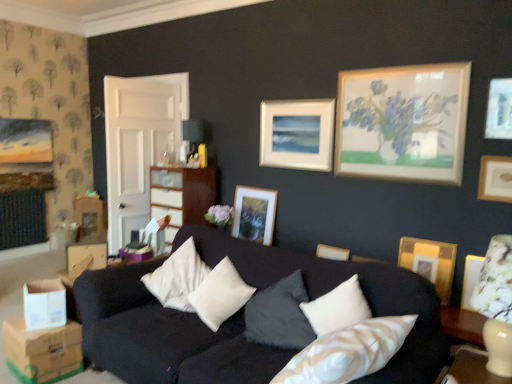
Describe the element at coordinates (181, 196) in the screenshot. The height and width of the screenshot is (384, 512). I see `matte cream dresser at center` at that location.

From the picture: How much space does white cardboard box at lower left, positioned as the first cardboard box in top-to-bottom order, occupy horizontally?

white cardboard box at lower left, positioned as the first cardboard box in top-to-bottom order, is 26.90 centimeters in width.

Image resolution: width=512 pixels, height=384 pixels. What do you see at coordinates (42, 351) in the screenshot?
I see `brown cardboard box at lower left, placed as the 2th cardboard box when sorted from top to bottom` at bounding box center [42, 351].

What is the approximate width of matte gold picture frame at center, marked as the 4th picture frame in a front-to-back arrangement?

matte gold picture frame at center, marked as the 4th picture frame in a front-to-back arrangement, is 2.54 inches wide.

Where is `white soft cushion at center`? The image size is (512, 384). white soft cushion at center is located at coordinates (220, 295).

Locate an element on the screen. The height and width of the screenshot is (384, 512). wooden picture frame at upper right, marked as the first picture frame in a front-to-back arrangement is located at coordinates (495, 179).

Measure the distance between point [415,257] and camera.

Point [415,257] is 3.48 meters away from camera.

How much space does gold textured picture frame at right, the third picture frame positioned from the left, occupy horizontally?

gold textured picture frame at right, the third picture frame positioned from the left, is 3.68 inches wide.

I want to click on matte cream dresser at center, so click(181, 196).

Between white cardboard box at lower left, positioned as the first cardboard box in top-to-bottom order, and wooden picture frame at upper right, the fourth picture frame positioned from the left, which one has more height?

wooden picture frame at upper right, the fourth picture frame positioned from the left, is taller.

Can you tell me how much white cardboard box at lower left, positioned as the first cardboard box in top-to-bottom order, and wooden picture frame at upper right, the fourth picture frame positioned from the left, differ in facing direction?

white cardboard box at lower left, positioned as the first cardboard box in top-to-bottom order, and wooden picture frame at upper right, the fourth picture frame positioned from the left, are facing 25 degrees away from each other.

Considering the sizes of objects white cardboard box at lower left, the second cardboard box ordered from the bottom, and wooden picture frame at upper right, marked as the first picture frame in a front-to-back arrangement, in the image provided, who is wider, white cardboard box at lower left, the second cardboard box ordered from the bottom, or wooden picture frame at upper right, marked as the first picture frame in a front-to-back arrangement,?

Wider between the two is white cardboard box at lower left, the second cardboard box ordered from the bottom.

In the image, is white cardboard box at lower left, the second cardboard box ordered from the bottom, positioned in front of or behind wooden picture frame at upper right, the fourth picture frame positioned from the left?

white cardboard box at lower left, the second cardboard box ordered from the bottom, is positioned closer to the viewer than wooden picture frame at upper right, the fourth picture frame positioned from the left.

Is point (153, 203) positioned behind point (72, 373)?

Yes, it is behind point (72, 373).

Can you confirm if matte cream dresser at center is taller than brown cardboard box at lower left, placed as the 2th cardboard box when sorted from top to bottom?

Correct, matte cream dresser at center is much taller as brown cardboard box at lower left, placed as the 2th cardboard box when sorted from top to bottom.

Is matte cream dresser at center positioned in front of brown cardboard box at lower left, the 1th cardboard box ordered from the bottom?

No, it is not.

Are matte cream dresser at center and wooden picture frame at upper right, acting as the 4th picture frame starting from the back, making contact?

No, matte cream dresser at center is not next to wooden picture frame at upper right, acting as the 4th picture frame starting from the back.

From the image's perspective, who appears lower, matte cream dresser at center or wooden picture frame at upper right, the fourth picture frame positioned from the left?

matte cream dresser at center appears lower in the image.

Considering the sizes of objects matte cream dresser at center and wooden picture frame at upper right, acting as the 4th picture frame starting from the back, in the image provided, who is wider, matte cream dresser at center or wooden picture frame at upper right, acting as the 4th picture frame starting from the back,?

matte cream dresser at center.

Considering the relative sizes of matte cream dresser at center and wooden picture frame at upper right, marked as the first picture frame in a front-to-back arrangement, in the image provided, is matte cream dresser at center shorter than wooden picture frame at upper right, marked as the first picture frame in a front-to-back arrangement,?

No, matte cream dresser at center is not shorter than wooden picture frame at upper right, marked as the first picture frame in a front-to-back arrangement.

Is white cardboard box at lower left, the second cardboard box ordered from the bottom, positioned in front of matte cream dresser at center?

That is True.

What are the coordinates of `dresser lying above the white cardboard box at lower left, the second cardboard box ordered from the bottom (from the image's perspective)` in the screenshot? It's located at (181, 196).

From a real-world perspective, is white cardboard box at lower left, the second cardboard box ordered from the bottom, on top of matte cream dresser at center?

Incorrect, from a real-world perspective, white cardboard box at lower left, the second cardboard box ordered from the bottom, is lower than matte cream dresser at center.

Are white cardboard box at lower left, the second cardboard box ordered from the bottom, and matte cream dresser at center beside each other?

No, white cardboard box at lower left, the second cardboard box ordered from the bottom, is not next to matte cream dresser at center.

Is brown cardboard box at lower left, the 1th cardboard box ordered from the bottom, oriented away from matte cream dresser at center?

Yes, brown cardboard box at lower left, the 1th cardboard box ordered from the bottom, is positioned with its back facing matte cream dresser at center.

Is brown cardboard box at lower left, placed as the 2th cardboard box when sorted from top to bottom, not near matte cream dresser at center?

Yes, brown cardboard box at lower left, placed as the 2th cardboard box when sorted from top to bottom, and matte cream dresser at center are located far from each other.

Consider the image. From a real-world perspective, is brown cardboard box at lower left, placed as the 2th cardboard box when sorted from top to bottom, physically located above or below matte cream dresser at center?

In terms of real-world spatial position, brown cardboard box at lower left, placed as the 2th cardboard box when sorted from top to bottom, is below matte cream dresser at center.

From their relative heights in the image, would you say brown cardboard box at lower left, the 1th cardboard box ordered from the bottom, is taller or shorter than matte cream dresser at center?

In the image, brown cardboard box at lower left, the 1th cardboard box ordered from the bottom, appears to be shorter than matte cream dresser at center.

Looking at this image, would you say white cardboard box at lower left, the second cardboard box ordered from the bottom, is part of matte gold picture frame at center, marked as the 4th picture frame in a front-to-back arrangement,'s contents?

Definitely not — white cardboard box at lower left, the second cardboard box ordered from the bottom, is not inside matte gold picture frame at center, marked as the 4th picture frame in a front-to-back arrangement.

Measure the distance between matte gold picture frame at center, marked as the 4th picture frame in a front-to-back arrangement, and white cardboard box at lower left, positioned as the first cardboard box in top-to-bottom order.

matte gold picture frame at center, marked as the 4th picture frame in a front-to-back arrangement, and white cardboard box at lower left, positioned as the first cardboard box in top-to-bottom order, are 6.78 feet apart.

Does matte gold picture frame at center, which is the first picture frame from back to front, have a greater height compared to white cardboard box at lower left, positioned as the first cardboard box in top-to-bottom order?

Correct, matte gold picture frame at center, which is the first picture frame from back to front, is much taller as white cardboard box at lower left, positioned as the first cardboard box in top-to-bottom order.

Is the depth of matte gold picture frame at center, marked as the 4th picture frame in a right-to-left arrangement, less than that of white cardboard box at lower left, the second cardboard box ordered from the bottom?

That is False.

Is gold textured picture frame at right, acting as the second picture frame starting from the front, touching matte gold picture frame at center, marked as the 4th picture frame in a right-to-left arrangement?

gold textured picture frame at right, acting as the second picture frame starting from the front, and matte gold picture frame at center, marked as the 4th picture frame in a right-to-left arrangement, are not in contact.

Which of these two, gold textured picture frame at right, the third picture frame positioned from the left, or matte gold picture frame at center, which is the 1th picture frame from left to right, is thinner?

Thinner between the two is matte gold picture frame at center, which is the 1th picture frame from left to right.

Between point (400, 265) and point (271, 199), which one is positioned behind?

The point (271, 199) is more distant.

Is gold textured picture frame at right, the third picture frame positioned from the left, turned away from matte gold picture frame at center, marked as the 4th picture frame in a right-to-left arrangement?

gold textured picture frame at right, the third picture frame positioned from the left, is not turned away from matte gold picture frame at center, marked as the 4th picture frame in a right-to-left arrangement.

Identify the location of cardboard box that is the 1st object located below the wooden picture frame at upper right, the fourth picture frame positioned from the left (from the image's perspective). (44, 304).

At what (x,y) coordinates should I click in order to perform the action: click on dresser above the brown cardboard box at lower left, placed as the 2th cardboard box when sorted from top to bottom (from a real-world perspective). Please return your answer as a coordinate pair (x, y). Looking at the image, I should click on (181, 196).

Based on their spatial positions, is white soft cushion at center or matte gold picture frame at center, marked as the 4th picture frame in a front-to-back arrangement, closer to wooden picture frame at upper right, marked as the first picture frame in a front-to-back arrangement?

Among the two, white soft cushion at center is located nearer to wooden picture frame at upper right, marked as the first picture frame in a front-to-back arrangement.

Estimate the real-world distances between objects in this image. Which object is further from matte cream dresser at center, wooden picture frame at upper right, the 1th picture frame when ordered from right to left, or white soft cushion at center?

wooden picture frame at upper right, the 1th picture frame when ordered from right to left, is further to matte cream dresser at center.

Based on their spatial positions, is gold textured picture frame at right, acting as the second picture frame starting from the front, or white cardboard box at lower left, the second cardboard box ordered from the bottom, closer to brown cardboard box at lower left, placed as the 2th cardboard box when sorted from top to bottom?

white cardboard box at lower left, the second cardboard box ordered from the bottom, lies closer to brown cardboard box at lower left, placed as the 2th cardboard box when sorted from top to bottom, than the other object.

Considering their positions, is matte white picture frame at center, which is counted as the third picture frame, starting from the right, positioned closer to matte cream dresser at center than matte gold picture frame at center, marked as the 4th picture frame in a front-to-back arrangement?

Among the two, matte gold picture frame at center, marked as the 4th picture frame in a front-to-back arrangement, is located nearer to matte cream dresser at center.

Which object lies nearer to the anchor point matte gold picture frame at center, which is the first picture frame from back to front, white soft cushion at center or matte cream dresser at center?

matte cream dresser at center is positioned closer to the anchor matte gold picture frame at center, which is the first picture frame from back to front.

Estimate the real-world distances between objects in this image. Which object is further from white soft cushion at center, matte gold picture frame at center, marked as the 4th picture frame in a right-to-left arrangement, or matte cream dresser at center?

matte gold picture frame at center, marked as the 4th picture frame in a right-to-left arrangement, is positioned further to the anchor white soft cushion at center.

Based on the photo, from the image, which object appears to be farther from brown cardboard box at lower left, placed as the 2th cardboard box when sorted from top to bottom, white soft cushion at center or gold textured picture frame at right, acting as the second picture frame starting from the front?

gold textured picture frame at right, acting as the second picture frame starting from the front, is further to brown cardboard box at lower left, placed as the 2th cardboard box when sorted from top to bottom.

Looking at the image, which one is located closer to white cardboard box at lower left, the second cardboard box ordered from the bottom, matte white picture frame at center, placed as the second picture frame when sorted from left to right, or brown cardboard box at lower left, placed as the 2th cardboard box when sorted from top to bottom?

Based on the image, brown cardboard box at lower left, placed as the 2th cardboard box when sorted from top to bottom, appears to be nearer to white cardboard box at lower left, the second cardboard box ordered from the bottom.

At what (x,y) coordinates should I click in order to perform the action: click on cardboard box between brown cardboard box at lower left, the 1th cardboard box ordered from the bottom, and white soft cushion at center. Please return your answer as a coordinate pair (x, y). This screenshot has width=512, height=384. Looking at the image, I should click on (44, 304).

The image size is (512, 384). Identify the location of pillow between brown cardboard box at lower left, the 1th cardboard box ordered from the bottom, and matte white picture frame at center, placed as the second picture frame when sorted from left to right, from left to right. (220, 295).

Identify the location of dresser between white cardboard box at lower left, the second cardboard box ordered from the bottom, and wooden picture frame at upper right, the 1th picture frame when ordered from right to left. The height and width of the screenshot is (384, 512). (181, 196).

Where is `pillow located between matte cream dresser at center and gold textured picture frame at right, acting as the second picture frame starting from the front, in the left-right direction`? pillow located between matte cream dresser at center and gold textured picture frame at right, acting as the second picture frame starting from the front, in the left-right direction is located at coordinates (220, 295).